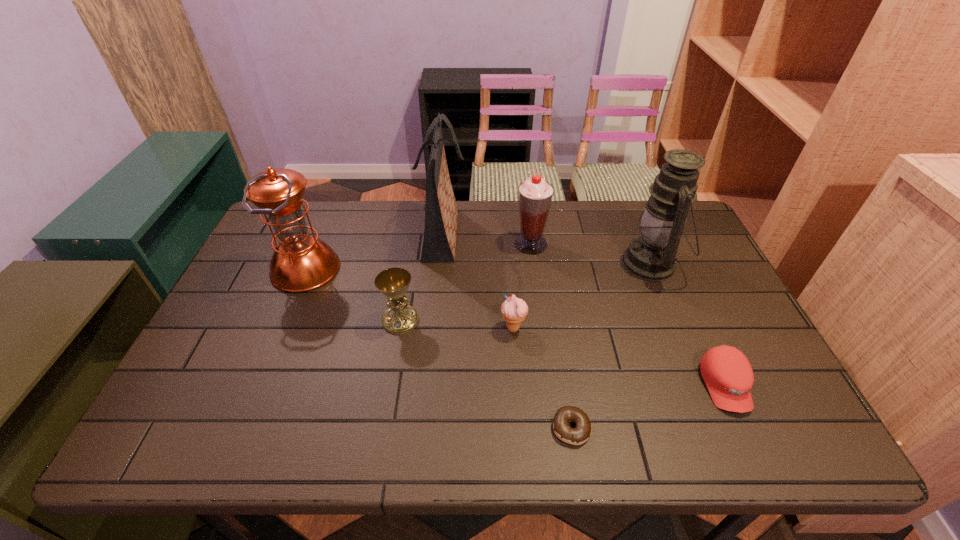
The height and width of the screenshot is (540, 960). I want to click on free space located 0.130m on the front of the left oil lamp, so click(x=280, y=330).

Image resolution: width=960 pixels, height=540 pixels. In order to click on free region located 0.320m on the front of the fifth shortest object in this screenshot , I will do `click(542, 335)`.

You are a GUI agent. You are given a task and a screenshot of the screen. Output one action in this format:
    pyautogui.click(x=<x>, y=<y>)
    Task: Click on the free spot located 0.140m on the front of the chalice
    
    Given the screenshot: What is the action you would take?
    point(391,380)

This screenshot has height=540, width=960. I want to click on free spot located 0.230m on the left of the third shortest object, so click(413, 328).

Find the location of `free point located 0.150m on the back of the doughnut`. free point located 0.150m on the back of the doughnut is located at coordinates (561, 355).

Identify the location of shopping bag positioned at the far edge. Image resolution: width=960 pixels, height=540 pixels. (439, 243).

The width and height of the screenshot is (960, 540). What are the coordinates of `oil lamp that is positioned at the far edge` in the screenshot? It's located at 652,256.

The height and width of the screenshot is (540, 960). What are the coordinates of `smoothie situated at the far edge` in the screenshot? It's located at (x=535, y=195).

Find the location of a particular element. cap that is positioned at the near edge is located at coordinates (728, 375).

Identify the location of doughnut that is at the near edge. The image size is (960, 540). (580, 434).